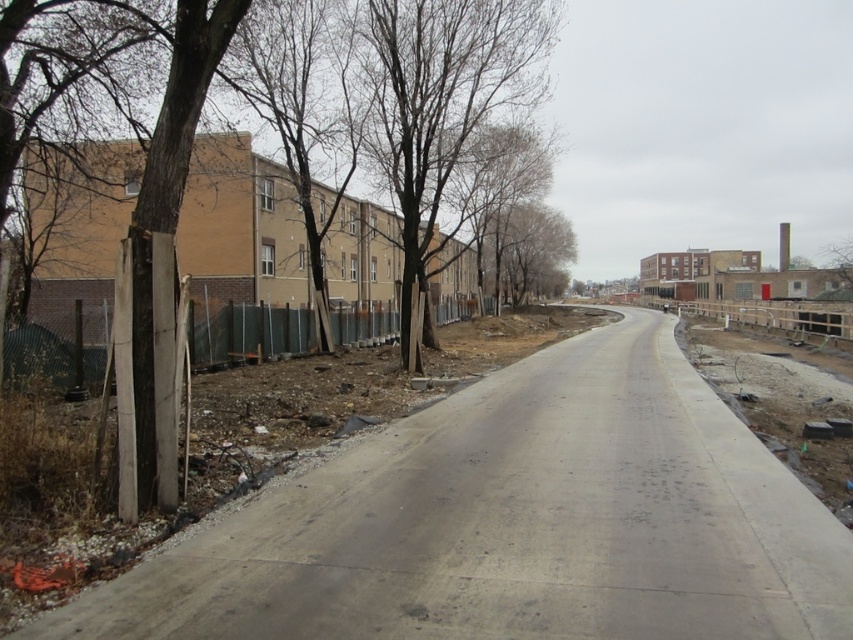
Is point (421, 28) farther from camera compared to point (527, 292)?

No, (421, 28) is closer to viewer.

Who is more distant from viewer, [418,28] or [556,269]?

The point [556,269] is behind.

Is point (383, 108) positioned before point (521, 269)?

Yes, point (383, 108) is closer to viewer.

Where is `brown bark tree at upper center`? The height and width of the screenshot is (640, 853). brown bark tree at upper center is located at coordinates (444, 118).

Can you confirm if gray concrete alley at left is smaller than bare branches at center?

Indeed, gray concrete alley at left has a smaller size compared to bare branches at center.

Which is above, gray concrete alley at left or bare branches at center?

Positioned higher is bare branches at center.

Where is `gray concrete alley at left`? This screenshot has width=853, height=640. gray concrete alley at left is located at coordinates (514, 524).

Who is positioned more to the left, wooden fence at left or bare branches at center?

wooden fence at left is more to the left.

Is wooden fence at left shorter than bare branches at center?

Yes, wooden fence at left is shorter than bare branches at center.

Is point (200, 317) in front of point (553, 225)?

Yes.

Where is `wooden fence at left`? This screenshot has height=640, width=853. wooden fence at left is located at coordinates (247, 333).